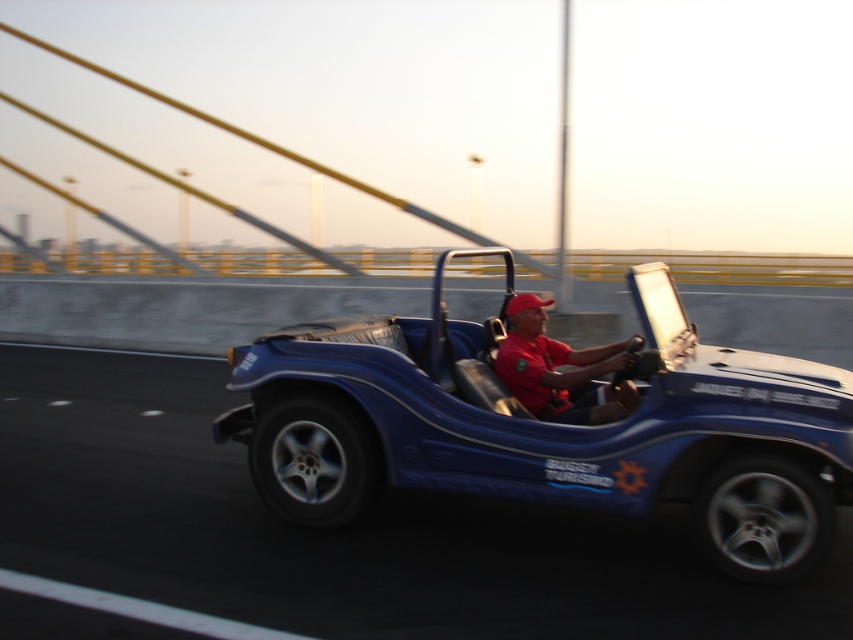
Question: Is blue matte buggy at center positioned at the back of red matte shirt at center?

Choices:
 (A) yes
 (B) no

Answer: (B)

Question: Does blue matte buggy at center have a smaller size compared to red matte shirt at center?

Choices:
 (A) yes
 (B) no

Answer: (B)

Question: Which of the following is the farthest from the observer?

Choices:
 (A) blue matte buggy at center
 (B) red matte shirt at center

Answer: (B)

Question: Can you confirm if blue matte buggy at center is positioned above red matte shirt at center?

Choices:
 (A) no
 (B) yes

Answer: (A)

Question: Which point appears farthest from the camera in this image?

Choices:
 (A) (558, 401)
 (B) (428, 472)

Answer: (A)